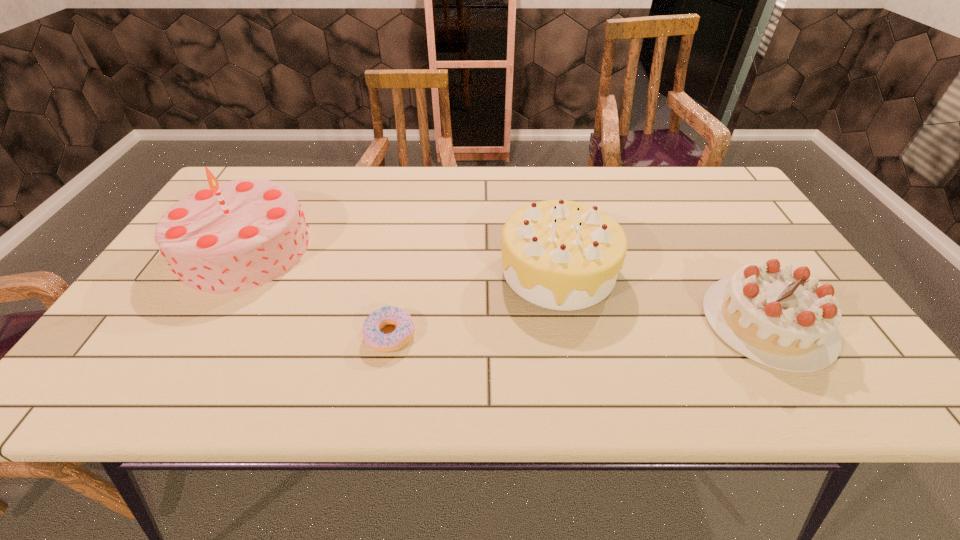
Identify the location of vacant space located 0.170m on the left of the shortest birthday cake. The height and width of the screenshot is (540, 960). coord(630,322).

Where is `free space located on the right of the third object from right to left`? free space located on the right of the third object from right to left is located at coordinates (494, 335).

The height and width of the screenshot is (540, 960). In order to click on object at the near edge in this screenshot , I will do `click(778, 316)`.

The image size is (960, 540). I want to click on object that is at the left edge, so click(229, 237).

The image size is (960, 540). In order to click on object situated at the right edge in this screenshot , I will do `click(778, 316)`.

Find the location of a particular element. object that is positioned at the near right corner is located at coordinates (778, 316).

This screenshot has height=540, width=960. In order to click on vacant space at the far edge of the desktop in this screenshot , I will do coord(559,198).

Identify the location of vacant space at the left edge of the desktop. This screenshot has height=540, width=960. (139, 309).

Find the location of a particular element. The height and width of the screenshot is (540, 960). free space at the right edge of the desktop is located at coordinates (847, 359).

The height and width of the screenshot is (540, 960). I want to click on free space at the near left corner of the desktop, so click(x=116, y=364).